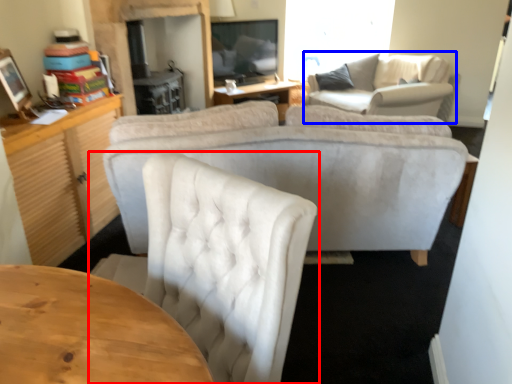
Question: Which of the following is the farthest to the observer, chair (highlighted by a red box) or couch (highlighted by a blue box)?

Choices:
 (A) chair
 (B) couch

Answer: (B)